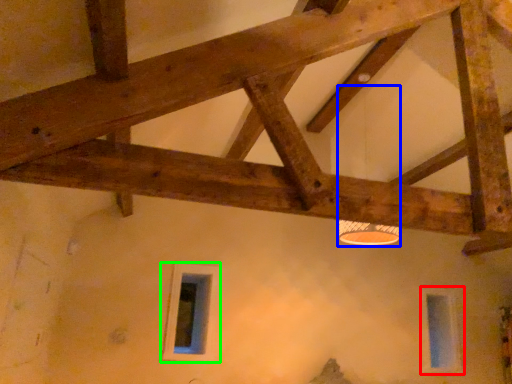
Question: Based on their relative distances, which object is nearer to window (highlighted by a red box)? Choose from lamp (highlighted by a blue box) and window (highlighted by a green box).

Choices:
 (A) lamp
 (B) window

Answer: (A)